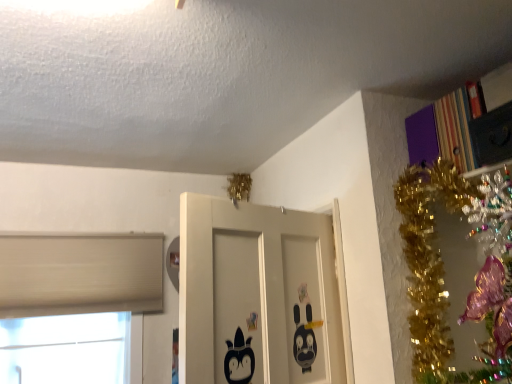
Question: Is black matte door at center to the left of white matte window at lower left from the viewer's perspective?

Choices:
 (A) no
 (B) yes

Answer: (A)

Question: Considering the relative sizes of black matte door at center and white matte window at lower left in the image provided, is black matte door at center smaller than white matte window at lower left?

Choices:
 (A) no
 (B) yes

Answer: (A)

Question: From a real-world perspective, is black matte door at center positioned over white matte window at lower left based on gravity?

Choices:
 (A) no
 (B) yes

Answer: (B)

Question: Considering the relative sizes of black matte door at center and white matte window at lower left in the image provided, is black matte door at center wider than white matte window at lower left?

Choices:
 (A) no
 (B) yes

Answer: (B)

Question: Is black matte door at center closer to camera compared to white matte window at lower left?

Choices:
 (A) yes
 (B) no

Answer: (A)

Question: Is black matte door at center surrounding white matte window at lower left?

Choices:
 (A) no
 (B) yes

Answer: (A)

Question: Is white matte window at lower left located outside black matte door at center?

Choices:
 (A) no
 (B) yes

Answer: (B)

Question: Is black matte door at center inside white matte window at lower left?

Choices:
 (A) yes
 (B) no

Answer: (B)

Question: Considering the relative sizes of white matte window at lower left and black matte door at center in the image provided, is white matte window at lower left bigger than black matte door at center?

Choices:
 (A) yes
 (B) no

Answer: (B)

Question: Does white matte window at lower left appear on the right side of black matte door at center?

Choices:
 (A) yes
 (B) no

Answer: (B)

Question: Is black matte door at center at the back of white matte window at lower left?

Choices:
 (A) no
 (B) yes

Answer: (A)

Question: Considering the relative positions of white matte window at lower left and black matte door at center in the image provided, is white matte window at lower left behind black matte door at center?

Choices:
 (A) no
 (B) yes

Answer: (B)

Question: Does black matte door at center have a greater width compared to striped cardboard bookcase at upper right?

Choices:
 (A) yes
 (B) no

Answer: (A)